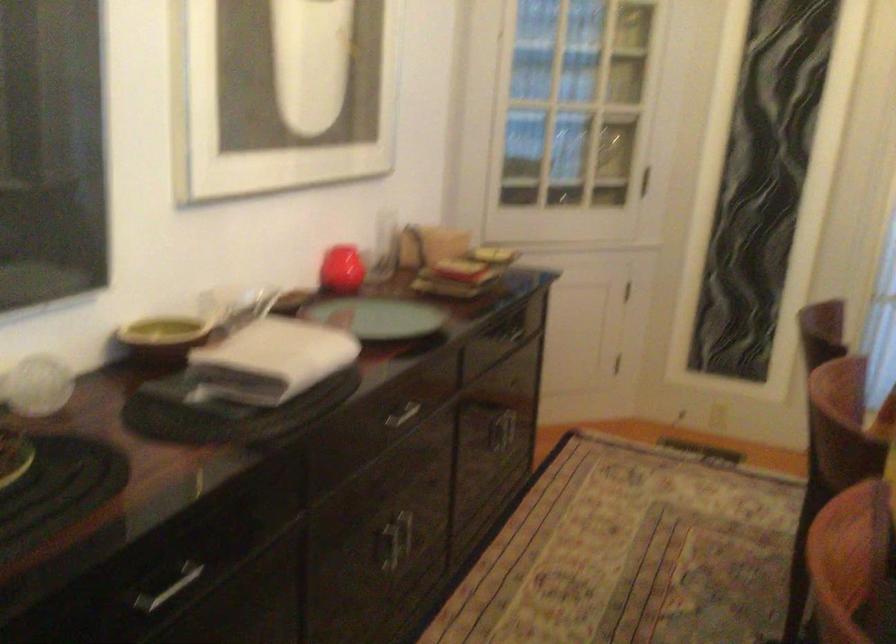
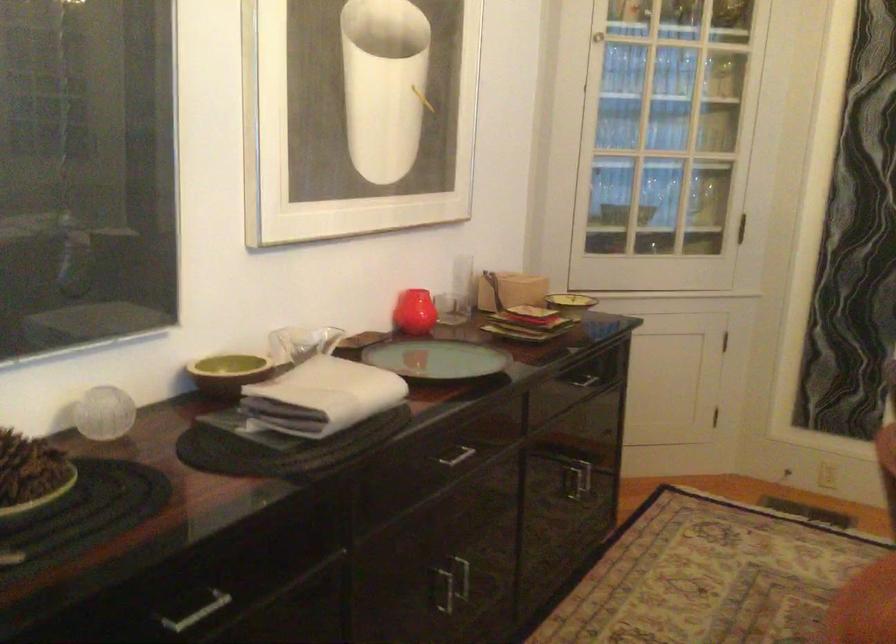
Locate, in the second image, the point that corresponds to (x=171, y=337) in the first image.

(228, 373)